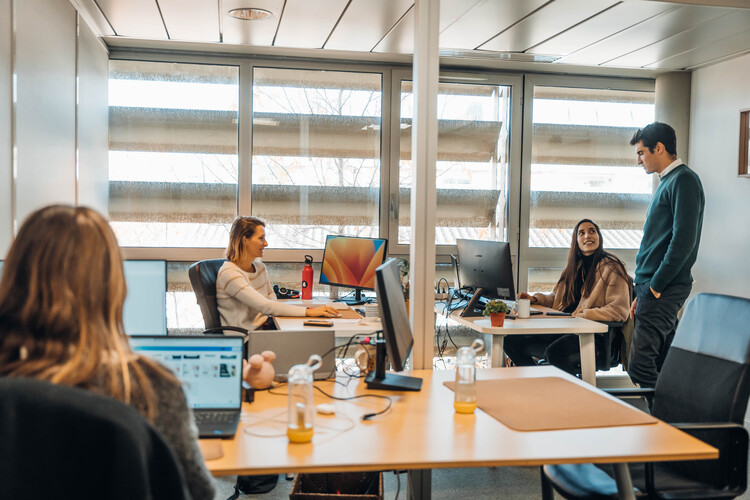
Where is `drink cups`? This screenshot has height=500, width=750. drink cups is located at coordinates (469, 380), (296, 405), (303, 278), (520, 312).